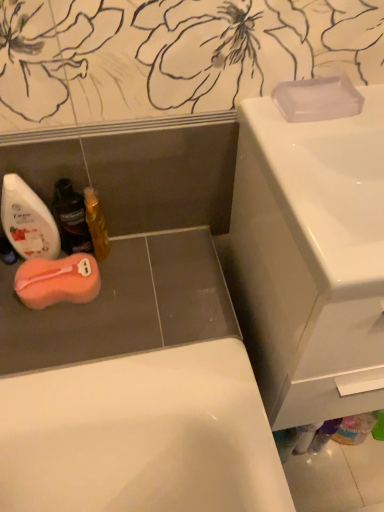
Question: In terms of width, does shiny gold bottle at lower left, the 1th mouthwash in the right-to-left sequence, look wider or thinner when compared to white glossy sink at upper right?

Choices:
 (A) wide
 (B) thin

Answer: (B)

Question: Looking at the image, does shiny gold bottle at lower left, the 1th mouthwash in the right-to-left sequence, seem bigger or smaller compared to white glossy sink at upper right?

Choices:
 (A) small
 (B) big

Answer: (A)

Question: Which is nearer to the shiny gold bottle at lower left, the 1th mouthwash in the right-to-left sequence?

Choices:
 (A) transparent plastic soap at upper right, which is the 1th soap from right to left
 (B) pink sponge at lower left, which ranks as the second soap in right-to-left order
 (C) translucent plastic mouthwash at lower left, arranged as the second mouthwash when viewed from the left
 (D) white glossy sink at upper right
 (E) translucent plastic mouthwash at lower left, the 3th mouthwash positioned from the right

Answer: (C)

Question: Which is nearer to the pink sponge at lower left, positioned as the 2th soap in top-to-bottom order?

Choices:
 (A) transparent plastic soap at upper right, placed as the 2th soap when sorted from left to right
 (B) white glossy sink at upper right
 (C) translucent plastic mouthwash at lower left, positioned as the 1th mouthwash in left-to-right order
 (D) translucent plastic mouthwash at lower left, arranged as the second mouthwash when viewed from the left
 (E) shiny gold bottle at lower left, the 1th mouthwash in the right-to-left sequence

Answer: (C)